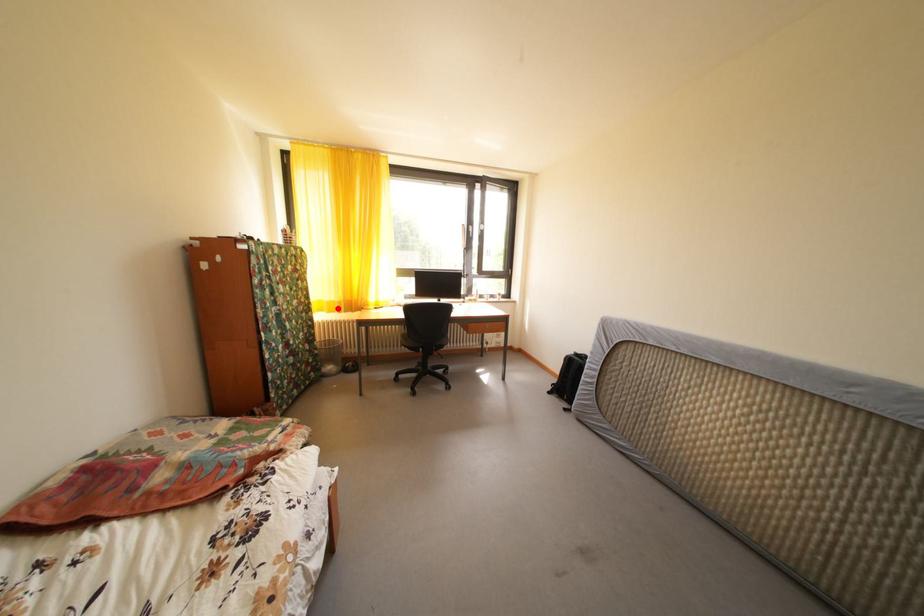
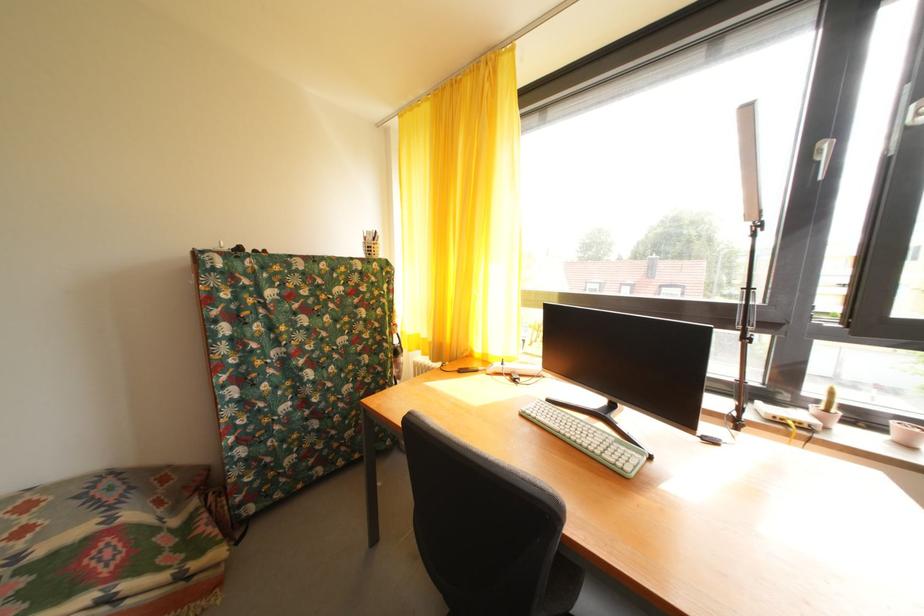
In the second image, find the point that corresponds to the highlighted location in the first image.

(432, 346)